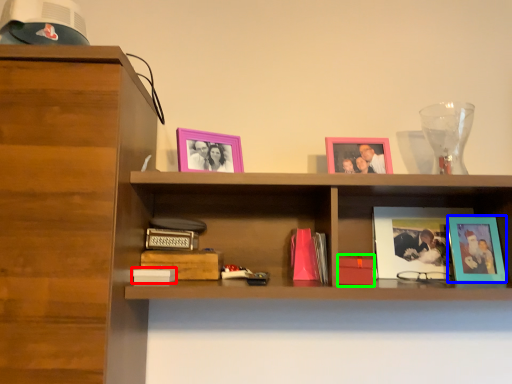
Question: Which object is positioned closest to paperback book (highlighted by a red box)? Select from picture frame (highlighted by a blue box) and paperback book (highlighted by a green box).

Choices:
 (A) picture frame
 (B) paperback book

Answer: (B)